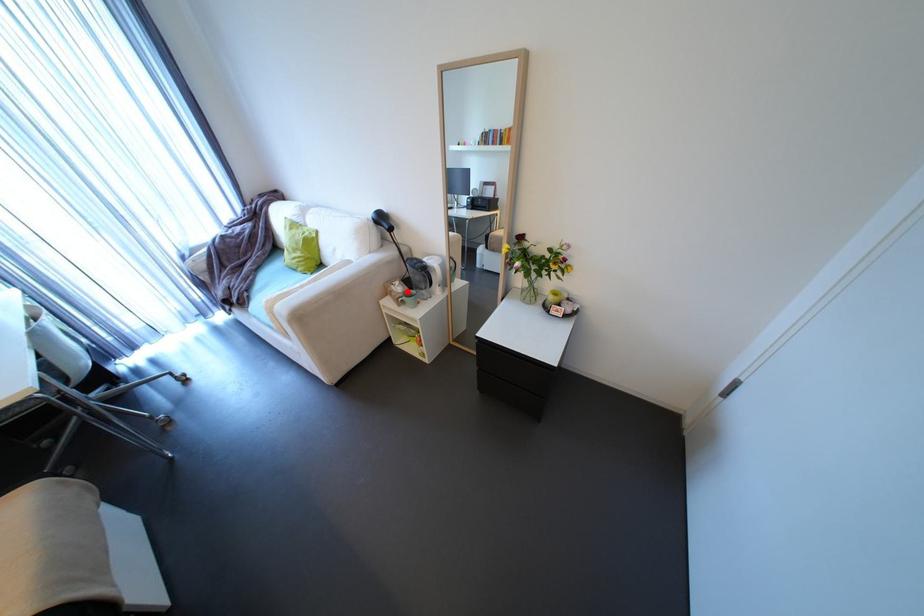
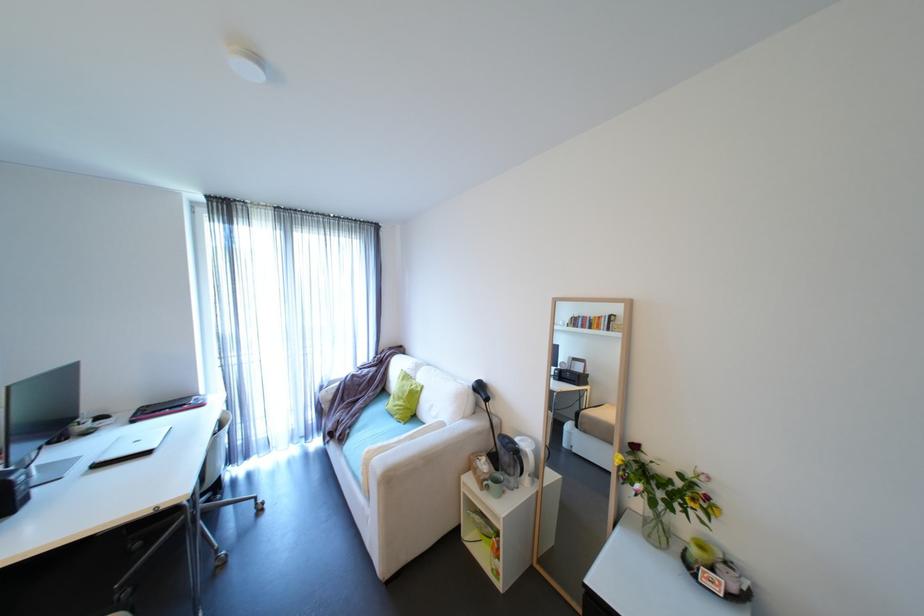
In the second image, find the point that corresponds to the highlighted location in the first image.

(492, 471)